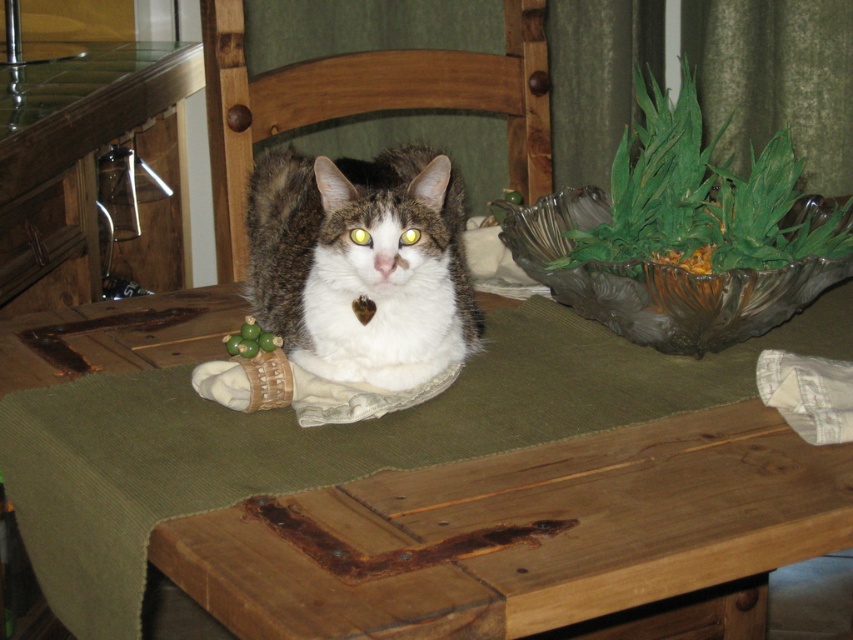
You are positioning a camera to capture the wooden table at center in the image. What are the coordinates where you should aim the camera?

The wooden table at center is located at point (326,436), so you should aim the camera at those coordinates to capture it properly.

You are a photographer setting up for a pet photoshoot. You see the wooden table at center and the fuzzy brown and white cat at center in the scene. Based on their positions, which object is closer to the camera?

The fuzzy brown and white cat at center is closer to the camera than the wooden table at center because the wooden table at center is below the cat.

You are standing in the room and see the wooden table at center and the wooden chair at center. Which object is located to the right side from your perspective?

The wooden table at center is located to the right of the wooden chair at center, so the wooden table at center is on the right side.